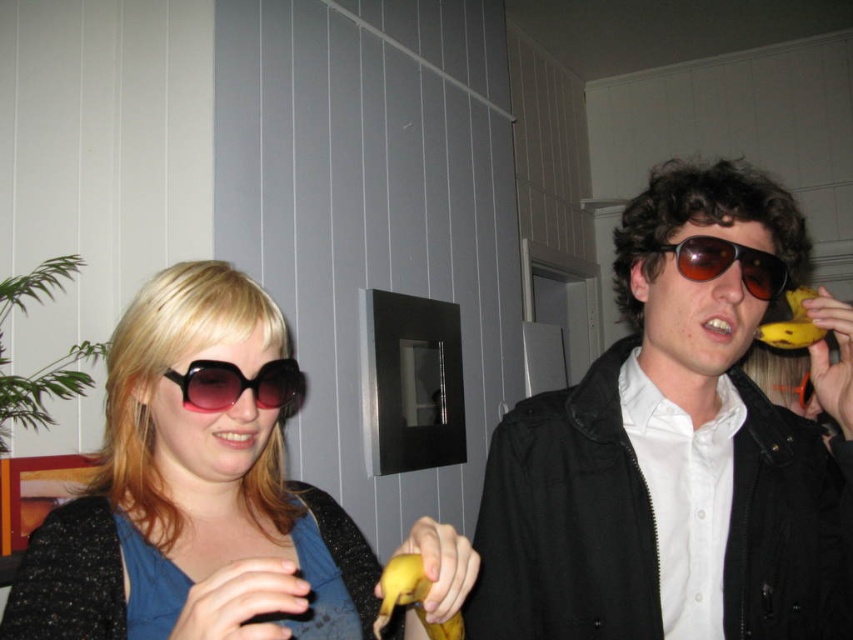
You are a photographer setting up a shoot in the room. You need to place a small light source directly above the yellow matte banana at right to highlight it. Where should you position the light relative to the matte black jacket at right?

The matte black jacket at right is located below the yellow matte banana at right, so you should position the light source above the yellow matte banana at right, which would place it above the matte black jacket at right as well.

You are a photographer setting up a photo shoot in this scene. You need to place a small prop exactly at the coordinates given in the Objects Description. Where should you place the yellow matte banana at lower center?

The yellow matte banana at lower center should be placed at the coordinates point (410,596) as specified in the Objects Description.